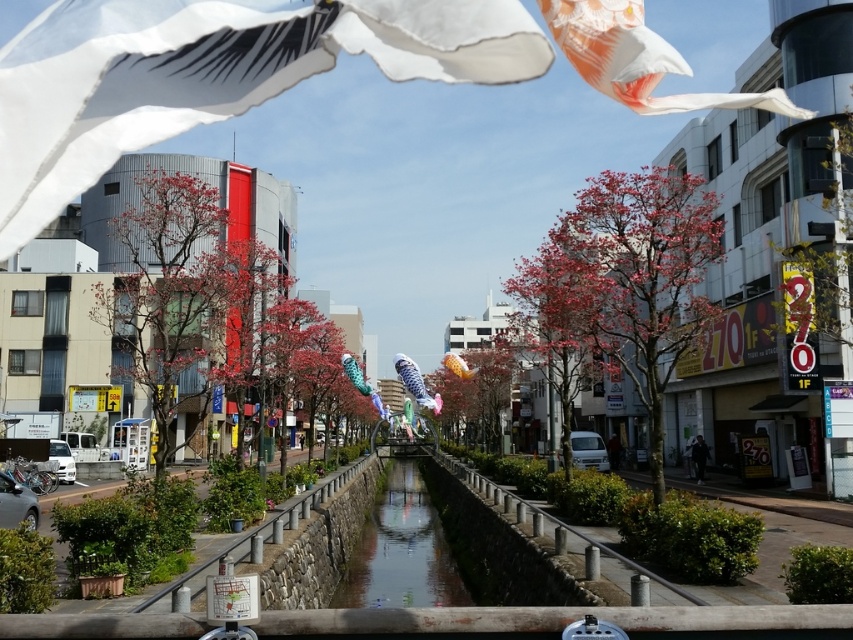
You are a drone operator who needs to fly a delivery drone from the white paper kite at upper right to the clear glass waterway at center. The drone has a maximum flight range of 15 meters. Can the drone make this trip without needing to recharge?

The white paper kite at upper right is 15.25 meters from the clear glass waterway at center. Since the drone can only fly 15 meters, it cannot complete the trip without recharging.

You are a photographer planning to capture the white paper kite at upper right and the clear glass waterway at center in a single frame. Which object will occupy more horizontal space in the photo?

The white paper kite at upper right will occupy more horizontal space in the photo since its width surpasses that of the clear glass waterway at center.